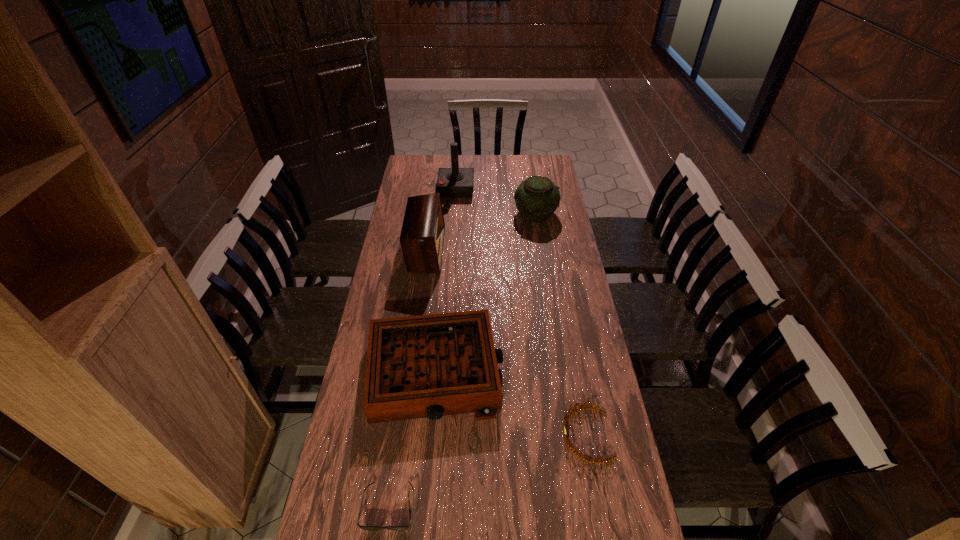
Where is `free space at the far edge of the desktop`? This screenshot has width=960, height=540. free space at the far edge of the desktop is located at coordinates (461, 160).

I want to click on vacant region at the left edge of the desktop, so [x=387, y=265].

Where is `vacant area that lies between the second shortest object and the pottery`? Image resolution: width=960 pixels, height=540 pixels. vacant area that lies between the second shortest object and the pottery is located at coordinates (561, 324).

Locate an element on the screen. This screenshot has height=540, width=960. vacant region between the pottery and the tiara is located at coordinates (561, 324).

You are a GUI agent. You are given a task and a screenshot of the screen. Output one action in this format:
    pyautogui.click(x=<x>, y=<y>)
    Task: Click on the empty space that is in between the tiara and the pottery
    This screenshot has width=960, height=540.
    Given the screenshot: What is the action you would take?
    pyautogui.click(x=561, y=324)

At what (x,y) coordinates should I click in order to perform the action: click on vacant space in between the gameboard and the radio receiver. Please return your answer as a coordinate pair (x, y). Looking at the image, I should click on (430, 310).

Where is `free point between the tallest object and the tiara`? free point between the tallest object and the tiara is located at coordinates (521, 312).

Locate an element on the screen. The height and width of the screenshot is (540, 960). unoccupied area between the fifth tallest object and the pottery is located at coordinates (561, 324).

Locate an element on the screen. vacant point located between the pottery and the farthest object is located at coordinates (495, 201).

I want to click on vacant space that's between the shortest object and the tiara, so click(488, 470).